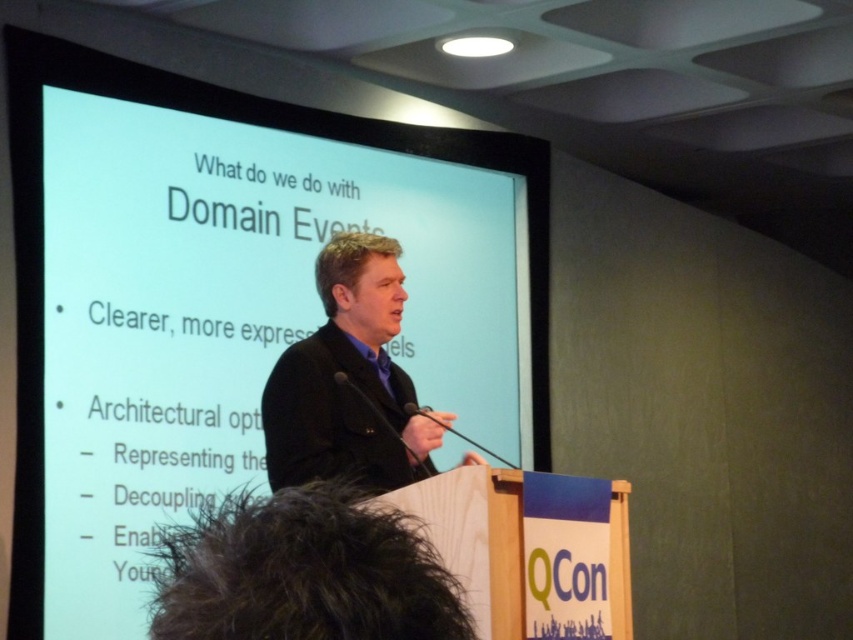
Based on the photo, you are an attendee at the conference and want to take a photo of the speaker. The white glossy projection screen at upper center and the black matte business suit at center are both in your camera frame. Which object should you focus on to ensure the speaker is clearly visible in your photo?

You should focus on the black matte business suit at center because the white glossy projection screen at upper center might be wider than the black matte business suit at center, so focusing on the speaker himself will ensure his visibility.

You are an attendee at the conference. You want to take a photo of the speaker and the projection screen. Since you are standing at the back, you need to ensure both the black matte business suit at center and the white glossy projection screen at upper center are in the frame. Based on their positions, can you confirm if the projection screen is positioned above the speaker?

The white glossy projection screen at upper center is above the black matte business suit at center, so yes, the projection screen is positioned above the speaker.

You are an attendee sitting in the front row of the conference. You notice the white glossy projection screen at upper center and the black matte business suit at center. Which object is closer to you?

The white glossy projection screen at upper center is closer to you because it is further to the viewer than the black matte business suit at center.